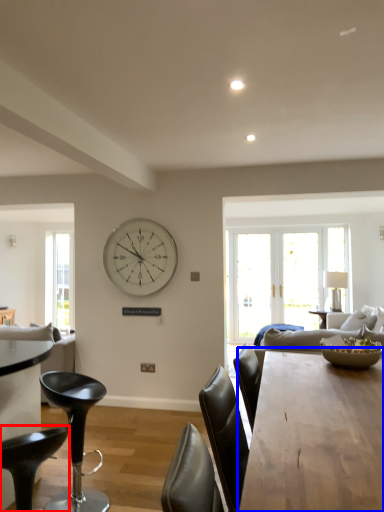
Question: Among these objects, which one is nearest to the camera, chair (highlighted by a red box) or kitchen & dining room table (highlighted by a blue box)?

Choices:
 (A) chair
 (B) kitchen & dining room table

Answer: (B)